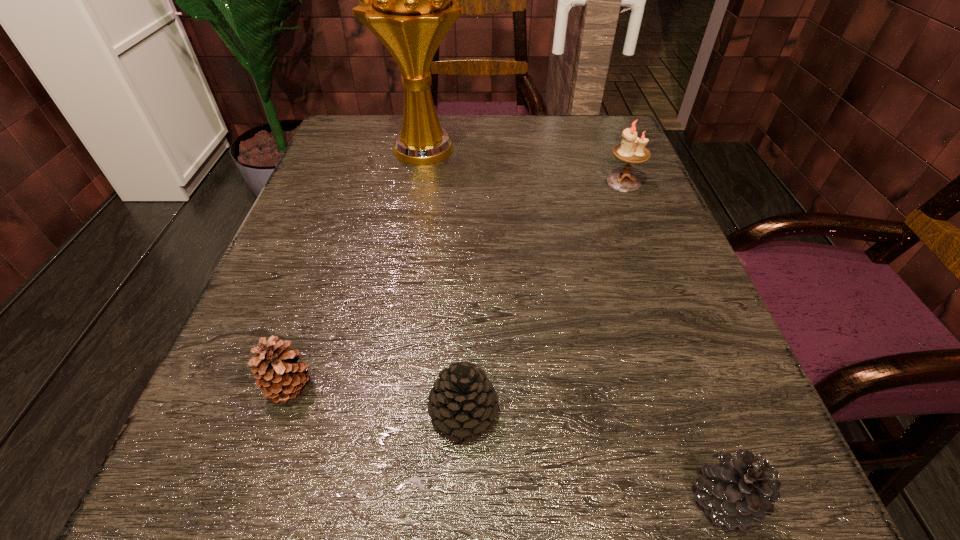
The image size is (960, 540). In the image, there is a desktop. In order to click on free space at the left edge in this screenshot , I will do `click(348, 215)`.

In the image, there is a desktop. At what (x,y) coordinates should I click in order to perform the action: click on vacant space at the right edge. Please return your answer as a coordinate pair (x, y). Image resolution: width=960 pixels, height=540 pixels. Looking at the image, I should click on (667, 274).

Find the location of a particular element. The height and width of the screenshot is (540, 960). vacant space at the near left corner of the desktop is located at coordinates (212, 534).

This screenshot has width=960, height=540. Find the location of `free space at the far right corner of the desktop`. free space at the far right corner of the desktop is located at coordinates (591, 158).

You are a GUI agent. You are given a task and a screenshot of the screen. Output one action in this format:
    pyautogui.click(x=<x>, y=<y>)
    Task: Click on the vacant area between the tallest object and the second pinecone from right to left
    This screenshot has height=540, width=960.
    Given the screenshot: What is the action you would take?
    [x=444, y=281]

What are the coordinates of `free space between the tallest object and the candle holder` in the screenshot? It's located at (525, 166).

At what (x,y) coordinates should I click in order to perform the action: click on empty location between the tallest object and the second tallest object. Please return your answer as a coordinate pair (x, y). Looking at the image, I should click on (525, 166).

Find the location of a particular element. The image size is (960, 540). vacant space in between the nearest object and the fourth shortest object is located at coordinates (673, 341).

Locate an element on the screen. free spot between the rightmost pinecone and the second pinecone from right to left is located at coordinates (593, 456).

In order to click on empty space that is in between the leftmost pinecone and the second pinecone from right to left in this screenshot , I will do `click(376, 400)`.